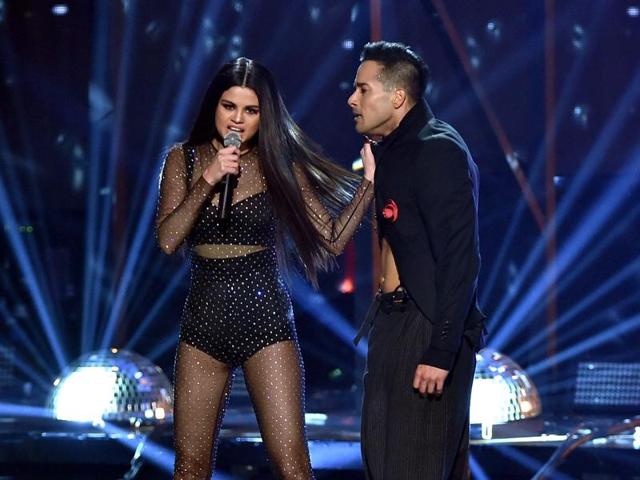
The height and width of the screenshot is (480, 640). I want to click on 4 brown beams, so click(548, 83), click(502, 135), click(374, 18), click(116, 206).